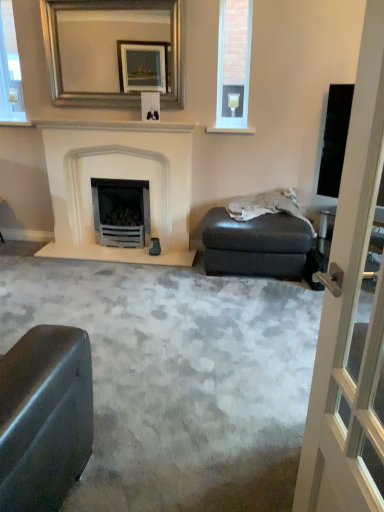
Question: Is white stone fireplace at center spatially inside black glossy screen door at right, or outside of it?

Choices:
 (A) outside
 (B) inside

Answer: (A)

Question: In terms of width, does white stone fireplace at center look wider or thinner when compared to black glossy screen door at right?

Choices:
 (A) wide
 (B) thin

Answer: (A)

Question: Which of these objects is positioned closest to the silver/golden-framed mirror at upper center?

Choices:
 (A) white stone fireplace at center
 (B) clear glass window at upper right
 (C) matte black footrest at center right
 (D) black glossy screen door at right
 (E) white glossy window frame at upper left

Answer: (A)

Question: Which of these objects is positioned farthest from the white glossy window frame at upper left?

Choices:
 (A) silver/golden-framed mirror at upper center
 (B) black glossy screen door at right
 (C) white stone fireplace at center
 (D) clear glass window at upper right
 (E) matte black footrest at center right

Answer: (B)